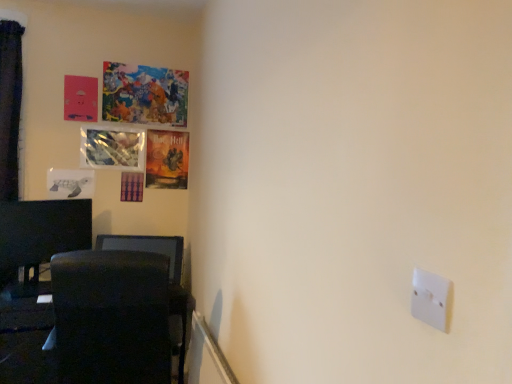
What do you see at coordinates (111, 317) in the screenshot?
I see `black fabric swivel chair at lower left` at bounding box center [111, 317].

Based on the photo, in order to face velvet dark blue curtain at left, should I rotate leftwards or rightwards?

Rotate your view left by about 30.272°.

Measure the distance between painted canvas artwork at upper left, the first picture frame when ordered from top to bottom, and camera.

The depth of painted canvas artwork at upper left, the first picture frame when ordered from top to bottom, is 2.93 meters.

At what (x,y) coordinates should I click in order to perform the action: click on white plastic light switch at lower right. Please return your answer as a coordinate pair (x, y). This screenshot has width=512, height=384. Looking at the image, I should click on (430, 298).

Find the location of a particular element. The height and width of the screenshot is (384, 512). black glossy monitor at left is located at coordinates (40, 234).

From the image's perspective, is velvet dark blue curtain at left located beneath white plastic light switch at lower right?

Actually, velvet dark blue curtain at left appears above white plastic light switch at lower right in the image.

Relative to white plastic light switch at lower right, is velvet dark blue curtain at left in front or behind?

In the image, velvet dark blue curtain at left appears behind white plastic light switch at lower right.

How different are the orientations of velvet dark blue curtain at left and white plastic light switch at lower right in degrees?

velvet dark blue curtain at left and white plastic light switch at lower right are facing 90.5 degrees away from each other.

Is velvet dark blue curtain at left smaller than white plastic light switch at lower right?

No, velvet dark blue curtain at left is not smaller than white plastic light switch at lower right.

Can you confirm if metallic reflective picture frame at upper left, which appears as the third picture frame when ordered from the bottom, is taller than black fabric swivel chair at lower left?

No.

Considering the positions of objects metallic reflective picture frame at upper left, which is the second picture frame in top-to-bottom order, and black fabric swivel chair at lower left in the image provided, who is more to the right, metallic reflective picture frame at upper left, which is the second picture frame in top-to-bottom order, or black fabric swivel chair at lower left?

black fabric swivel chair at lower left is more to the right.

Is metallic reflective picture frame at upper left, which appears as the third picture frame when ordered from the bottom, oriented towards black fabric swivel chair at lower left?

No, metallic reflective picture frame at upper left, which appears as the third picture frame when ordered from the bottom, does not turn towards black fabric swivel chair at lower left.

Is metallic reflective picture frame at upper left, which appears as the third picture frame when ordered from the bottom, positioned far away from black fabric swivel chair at lower left?

Indeed, metallic reflective picture frame at upper left, which appears as the third picture frame when ordered from the bottom, is not near black fabric swivel chair at lower left.

From the white paper turtle at left, which ranks as the first picture frame in bottom-to-top order, count 2nd picture frame to the right and point to it. Please provide its 2D coordinates.

[(144, 94)]

Could you tell me if white paper turtle at left, positioned as the 4th picture frame in top-to-bottom order, is facing painted canvas artwork at upper left, the first picture frame when ordered from top to bottom?

No, white paper turtle at left, positioned as the 4th picture frame in top-to-bottom order, is not turned towards painted canvas artwork at upper left, the first picture frame when ordered from top to bottom.

Which object is wider, white paper turtle at left, positioned as the 4th picture frame in top-to-bottom order, or painted canvas artwork at upper left, the first picture frame when ordered from top to bottom?

With larger width is painted canvas artwork at upper left, the first picture frame when ordered from top to bottom.

In the image, is white paper turtle at left, positioned as the 4th picture frame in top-to-bottom order, on the left side or the right side of painted canvas artwork at upper left, the first picture frame when ordered from top to bottom?

Clearly, white paper turtle at left, positioned as the 4th picture frame in top-to-bottom order, is on the left of painted canvas artwork at upper left, the first picture frame when ordered from top to bottom, in the image.

Is point (438, 296) positioned before point (115, 166)?

Yes, it is.

In terms of width, does white plastic light switch at lower right look wider or thinner when compared to metallic reflective picture frame at upper left, which appears as the third picture frame when ordered from the bottom?

Considering their sizes, white plastic light switch at lower right looks slimmer than metallic reflective picture frame at upper left, which appears as the third picture frame when ordered from the bottom.

From the image's perspective, is white plastic light switch at lower right located above or below metallic reflective picture frame at upper left, which is the second picture frame in top-to-bottom order?

From the image's perspective, white plastic light switch at lower right appears below metallic reflective picture frame at upper left, which is the second picture frame in top-to-bottom order.

In the image, is white plastic light switch at lower right positioned in front of or behind metallic reflective picture frame at upper left, which appears as the third picture frame when ordered from the bottom?

Visually, white plastic light switch at lower right is located in front of metallic reflective picture frame at upper left, which appears as the third picture frame when ordered from the bottom.

From the image's perspective, is velvet dark blue curtain at left located above metallic reflective picture frame at upper left, which appears as the third picture frame when ordered from the bottom?

No, from the image's perspective, velvet dark blue curtain at left is not above metallic reflective picture frame at upper left, which appears as the third picture frame when ordered from the bottom.

You are a GUI agent. You are given a task and a screenshot of the screen. Output one action in this format:
    pyautogui.click(x=<x>, y=<y>)
    Task: Click on the curtain on the left of the metallic reflective picture frame at upper left, which appears as the third picture frame when ordered from the bottom
    This screenshot has height=384, width=512.
    Given the screenshot: What is the action you would take?
    pyautogui.click(x=10, y=106)

Does velvet dark blue curtain at left turn towards metallic reflective picture frame at upper left, which is the second picture frame in top-to-bottom order?

No, velvet dark blue curtain at left is not aimed at metallic reflective picture frame at upper left, which is the second picture frame in top-to-bottom order.

What's the angular difference between velvet dark blue curtain at left and metallic reflective picture frame at upper left, which is the second picture frame in top-to-bottom order,'s facing directions?

The facing directions of velvet dark blue curtain at left and metallic reflective picture frame at upper left, which is the second picture frame in top-to-bottom order, are 0.00871 degrees apart.

Does white plastic light switch at lower right come behind black fabric swivel chair at lower left?

No.

Is white plastic light switch at lower right turned away from black fabric swivel chair at lower left?

No, black fabric swivel chair at lower left is not at the back of white plastic light switch at lower right.

In the scene shown: From the image's perspective, who appears lower, white plastic light switch at lower right or black fabric swivel chair at lower left?

black fabric swivel chair at lower left, from the image's perspective.

From a real-world perspective, between white plastic light switch at lower right and black fabric swivel chair at lower left, who is vertically higher?

white plastic light switch at lower right is physically above.

Are black fabric swivel chair at lower left and white plastic light switch at lower right located far from each other?

black fabric swivel chair at lower left is positioned a significant distance from white plastic light switch at lower right.

Looking at this image, does black fabric swivel chair at lower left contain white plastic light switch at lower right?

No, white plastic light switch at lower right is not surrounded by black fabric swivel chair at lower left.

From the image's perspective, relative to white plastic light switch at lower right, is black fabric swivel chair at lower left above or below?

black fabric swivel chair at lower left is situated lower than white plastic light switch at lower right in the image.

Is black fabric swivel chair at lower left turned away from white plastic light switch at lower right?

Correct, black fabric swivel chair at lower left is looking away from white plastic light switch at lower right.

In order to click on curtain that appears behind the white plastic light switch at lower right in this screenshot , I will do `click(10, 106)`.

You are a GUI agent. You are given a task and a screenshot of the screen. Output one action in this format:
    pyautogui.click(x=<x>, y=<y>)
    Task: Click on the 3rd picture frame positioned above the black fabric swivel chair at lower left (from a real-world perspective)
    This screenshot has height=384, width=512.
    Given the screenshot: What is the action you would take?
    pyautogui.click(x=112, y=148)

Estimate the real-world distances between objects in this image. Which object is further from white paper turtle at left, positioned as the 4th picture frame in top-to-bottom order, velvet dark blue curtain at left or white plastic light switch at lower right?

The object further to white paper turtle at left, positioned as the 4th picture frame in top-to-bottom order, is white plastic light switch at lower right.

Estimate the real-world distances between objects in this image. Which object is closer to painted canvas artwork at upper left, the fourth picture frame from the bottom, white plastic light switch at lower right or metallic reflective picture frame at upper left, which appears as the third picture frame when ordered from the bottom?

Among the two, metallic reflective picture frame at upper left, which appears as the third picture frame when ordered from the bottom, is located nearer to painted canvas artwork at upper left, the fourth picture frame from the bottom.

From the picture: Estimate the real-world distances between objects in this image. Which object is further from black fabric swivel chair at lower left, black glossy monitor at left or painted canvas artwork at upper left, the first picture frame when ordered from top to bottom?

Based on the image, painted canvas artwork at upper left, the first picture frame when ordered from top to bottom, appears to be further to black fabric swivel chair at lower left.

When comparing their distances from painted canvas artwork at upper left, the first picture frame when ordered from top to bottom, does black glossy monitor at left or metallic reflective picture frame at upper left, which is the second picture frame in top-to-bottom order, seem further?

Among the two, black glossy monitor at left is located further to painted canvas artwork at upper left, the first picture frame when ordered from top to bottom.

Which object lies nearer to the anchor point painted canvas artwork at upper left, the fourth picture frame from the bottom, metallic reflective picture frame at upper left, which is the second picture frame in top-to-bottom order, or velvet dark blue curtain at left?

metallic reflective picture frame at upper left, which is the second picture frame in top-to-bottom order, is positioned closer to the anchor painted canvas artwork at upper left, the fourth picture frame from the bottom.

When comparing their distances from metallic reflective picture frame at upper left, which appears as the third picture frame when ordered from the bottom, does black glossy monitor at left or black fabric swivel chair at lower left seem further?

The object further to metallic reflective picture frame at upper left, which appears as the third picture frame when ordered from the bottom, is black fabric swivel chair at lower left.

Considering their positions, is metallic reflective picture frame at upper left, which is the second picture frame in top-to-bottom order, positioned further to black fabric swivel chair at lower left than black glossy monitor at left?

The object further to black fabric swivel chair at lower left is metallic reflective picture frame at upper left, which is the second picture frame in top-to-bottom order.

Looking at the image, which one is located further to white paper turtle at left, positioned as the 4th picture frame in top-to-bottom order, metallic reflective picture frame at upper left, which appears as the third picture frame when ordered from the bottom, or black glossy monitor at left?

black glossy monitor at left is further to white paper turtle at left, positioned as the 4th picture frame in top-to-bottom order.

Identify the location of swivel chair between white plastic light switch at lower right and painted canvas artwork at upper left, the first picture frame when ordered from top to bottom, along the z-axis. click(x=111, y=317).

Where is `furniture positioned between white plastic light switch at lower right and white paper turtle at left, which ranks as the first picture frame in bottom-to-top order, from near to far`? This screenshot has width=512, height=384. furniture positioned between white plastic light switch at lower right and white paper turtle at left, which ranks as the first picture frame in bottom-to-top order, from near to far is located at coordinates (40, 234).

I want to click on furniture between velvet dark blue curtain at left and black fabric swivel chair at lower left vertically, so click(40, 234).

I want to click on curtain located between white plastic light switch at lower right and painted canvas artwork at upper left, the first picture frame when ordered from top to bottom, in the depth direction, so click(x=10, y=106).